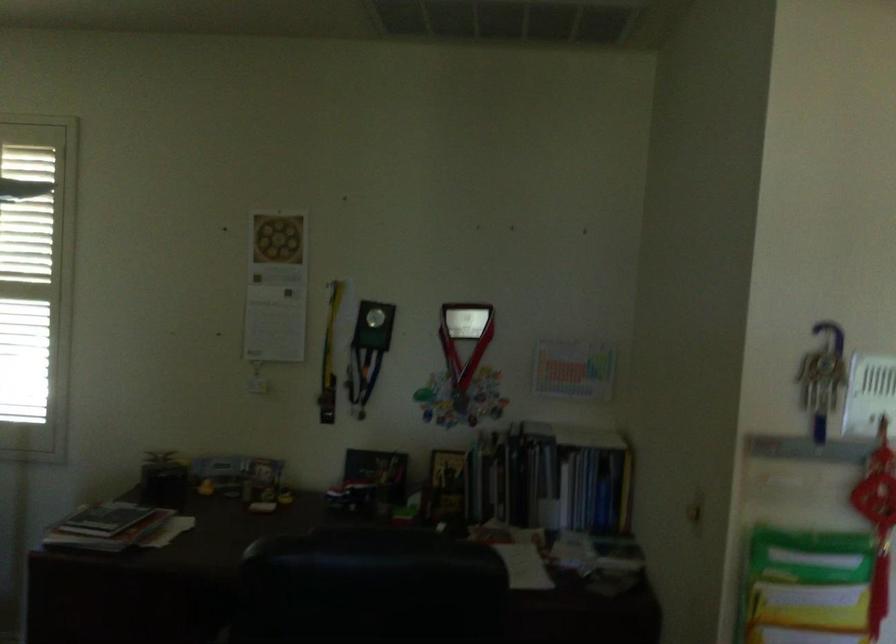
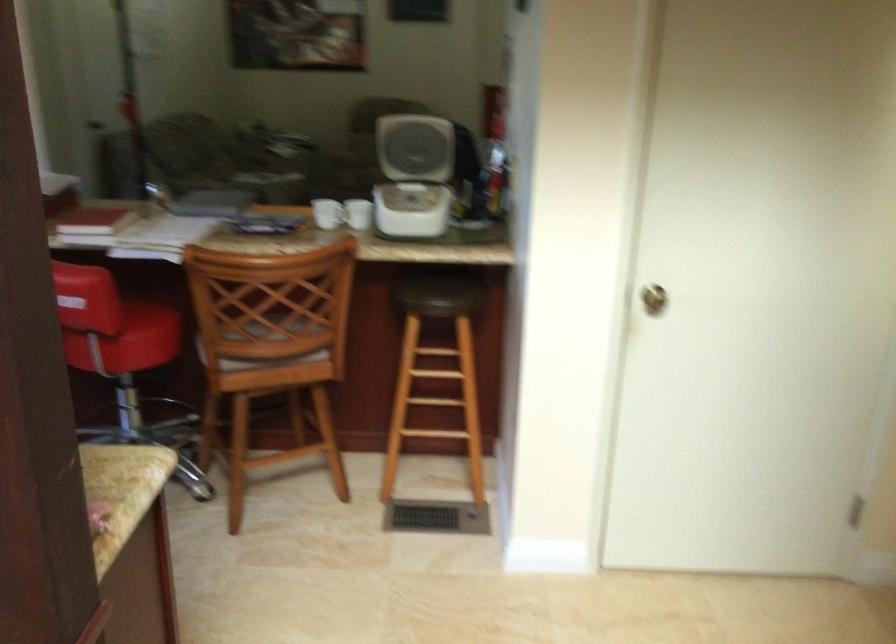
Question: I am providing you with two images of the same scene from different viewpoints. After the viewpoint changes to image2, which objects are now occluded?

Choices:
 (A) white appliance lid
 (B) small amber bottle
 (C) book
 (D) wooden chair sitting surface

Answer: (C)